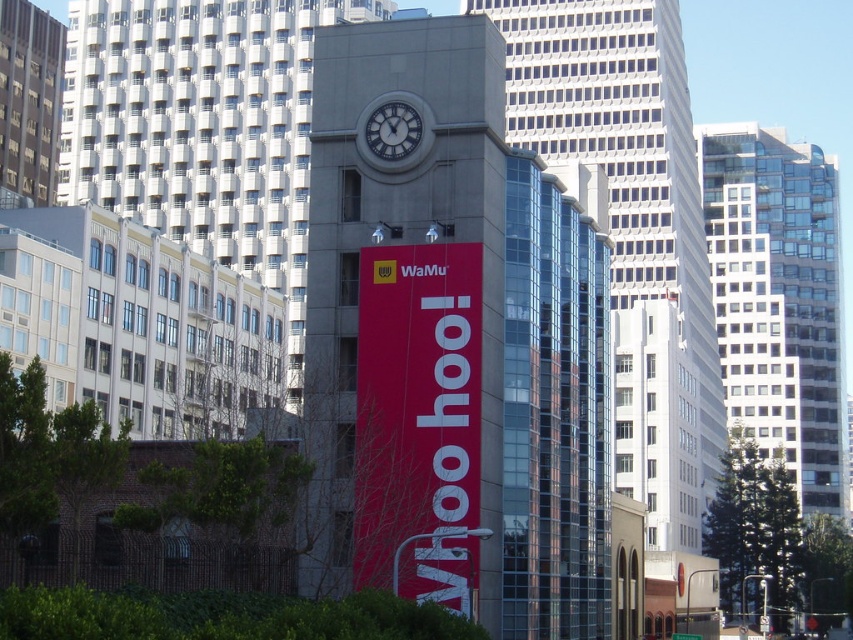
Is point (310, 385) farther from camera compared to point (276, 129)?

No, it is in front of (276, 129).

What do you see at coordinates (473, 337) in the screenshot? I see `concrete clock tower at center` at bounding box center [473, 337].

I want to click on concrete clock tower at center, so click(473, 337).

Is white textured building at center wider than metallic clock face at center?

Correct, the width of white textured building at center exceeds that of metallic clock face at center.

Between point (132, 3) and point (381, 128), which one is positioned in front?

Point (381, 128)

Find the location of a particular element. This screenshot has height=640, width=853. white textured building at center is located at coordinates (202, 128).

Is matte red banner at center above metallic clock face at center?

Actually, matte red banner at center is below metallic clock face at center.

Measure the distance between point [421,403] and camera.

They are 61.32 meters apart.

Does point (450, 420) come in front of point (397, 113)?

Yes, it is.

Where is `matte red banner at center`? Image resolution: width=853 pixels, height=640 pixels. matte red banner at center is located at coordinates (418, 420).